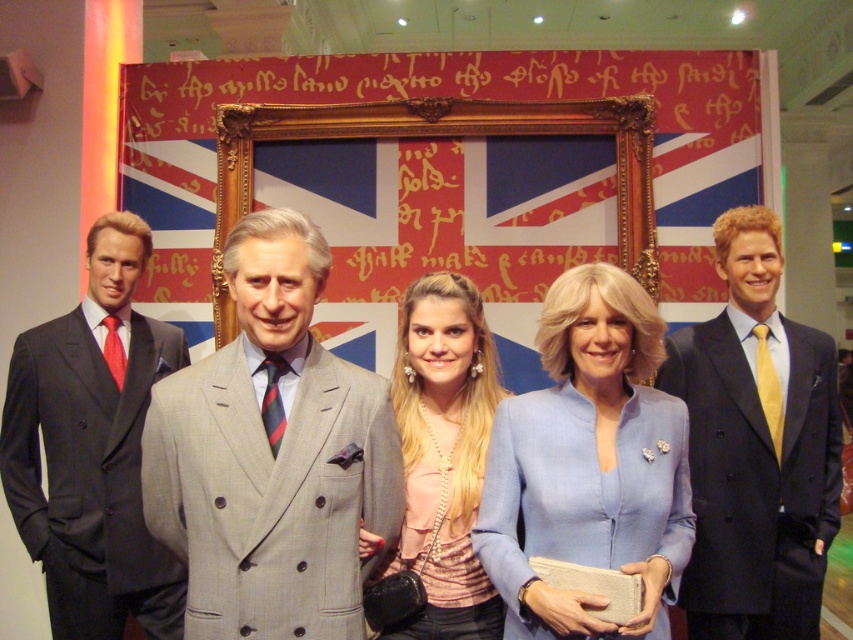
You are a photographer setting up for a group photo. You need to ensure that the dark blue suit at right and the pearl necklace at center are both visible in the frame. Given their sizes, which object should you focus on to ensure both are in focus?

The dark blue suit at right is taller than the pearl necklace at center, so focusing on the dark blue suit at right would ensure both are in focus as it is larger and requires more attention.

You are a security guard in a museum and need to ensure there is enough space between the light blue fabric jacket at center and the matte black suit at left for visitors to walk through. The museum requires a minimum of 1.5 meters between exhibits for safety. Is the current distance sufficient?

The light blue fabric jacket at center is 1.46 meters from the matte black suit at left. Since this distance is less than the required 1.5 meters, the current spacing does not meet the museum safety requirements.

You are standing in front of the group of figures. Which object is closer to you, the dark blue suit at right or the pearl necklace at center?

The dark blue suit at right is closer to you than the pearl necklace at center because it is further to the viewer.